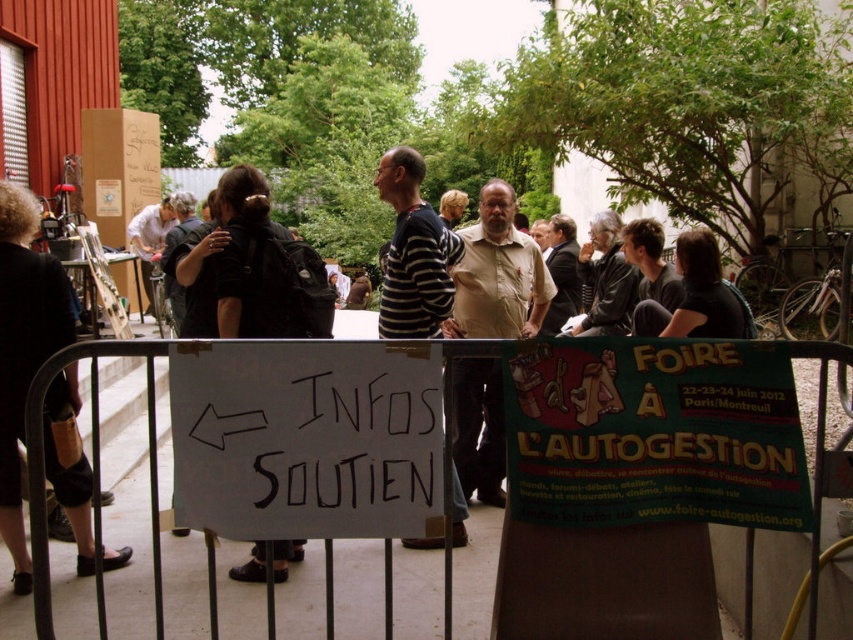
You are standing in the courtyard and see the beige cotton shirt at center and the white metal fence at center. Which object is located to the right of the other?

The beige cotton shirt at center is positioned on the right side of white metal fence at center.

You are a photographer trying to capture a photo of the beige cotton shirt at center and the white metal fence at center. If you want to ensure both objects are fully visible in the frame, which object should you focus on first to avoid cropping?

You should focus on the beige cotton shirt at center first because it might be wider than the white metal fence at center, so ensuring it fits properly would help in framing both objects without cropping.

You are organizing a community event and need to decide which clothing item to use as a backdrop. The beige cotton shirt at center and the black leather jacket at center are both available. Which one would you choose if you want the backdrop to be larger?

The beige cotton shirt at center is bigger than the black leather jacket at center, so you should choose the beige cotton shirt at center as the backdrop for a larger size.